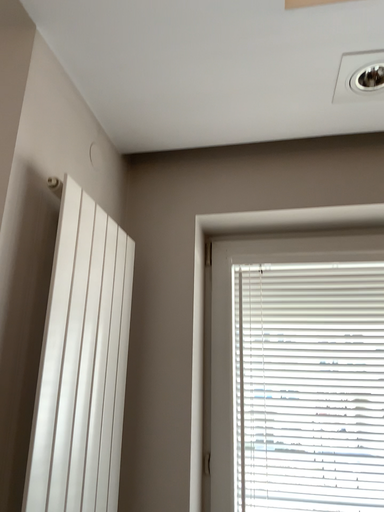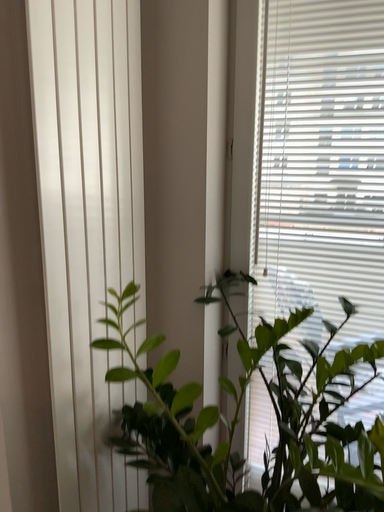
Question: How did the camera likely rotate when shooting the video?

Choices:
 (A) rotated downward
 (B) rotated upward

Answer: (A)